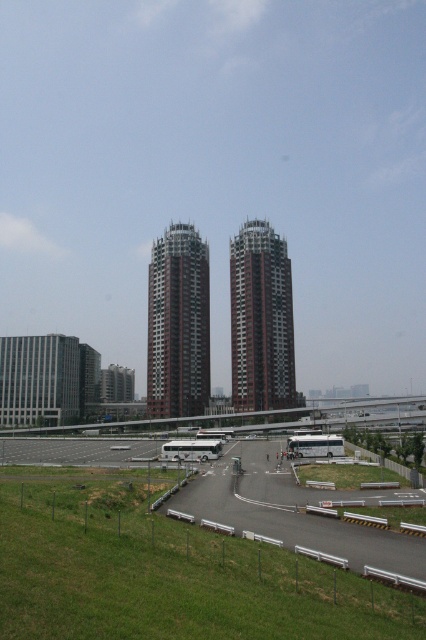
You are a delivery driver who needs to park your truck near the red brick building at center without blocking the white concrete race track at lower center. Where should you park?

You should park your truck near the red brick building at center but above it, since the white concrete race track at lower center is located below the red brick building at center and you don not want to block it.

Consider the image. You are a delivery driver who needs to park your truck near the white concrete race track at lower center without blocking the entrance of the red brick building at center. Can you park your truck on the race track?

The white concrete race track at lower center is not as tall as the red brick building at center, but since the race track is a paved area, it is likely suitable for parking. However, you should ensure that parking there does not block the entrance of the red brick building at center.

You are a city planner assessing the urban layout. Given the scene described, which of the two buildings at the center, the red brick building at center or the brown textured building at center, has a narrower width?

The red brick building at center is thinner than the brown textured building at center, so it has a narrower width.